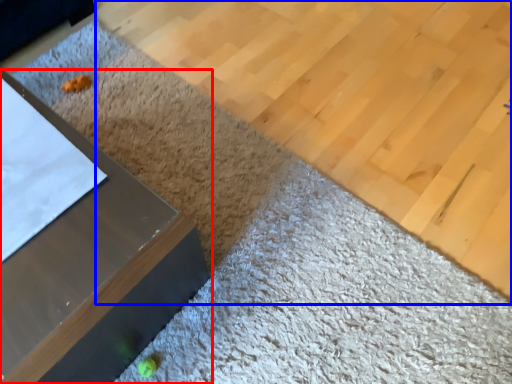
Question: Among these objects, which one is farthest to the camera, furniture (highlighted by a red box) or plywood (highlighted by a blue box)?

Choices:
 (A) furniture
 (B) plywood

Answer: (B)